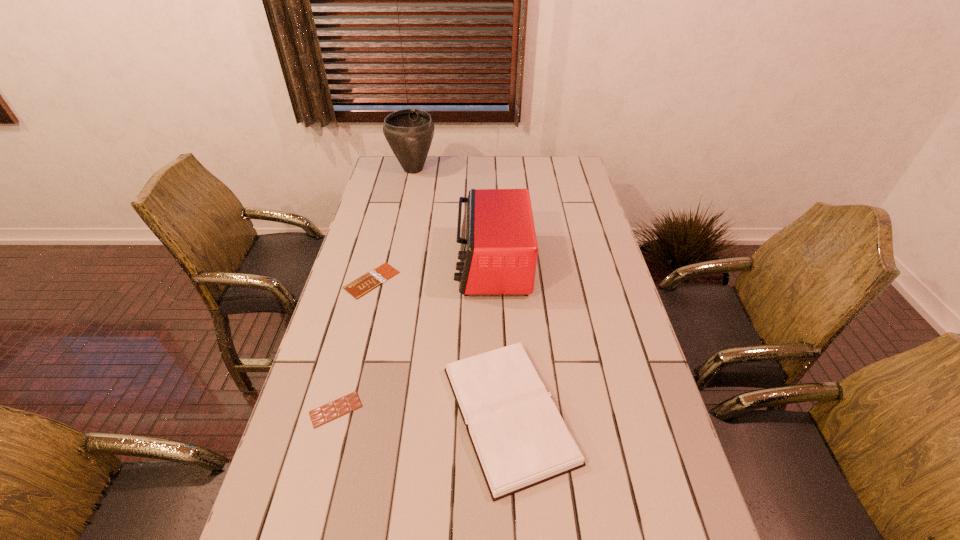
Locate an element on the screen. This screenshot has height=540, width=960. the farthest object is located at coordinates (409, 132).

This screenshot has height=540, width=960. Identify the location of urn. (409, 132).

Locate an element on the screen. This screenshot has height=540, width=960. the fourth shortest object is located at coordinates (498, 252).

Identify the location of the third tallest object. The width and height of the screenshot is (960, 540). 520,440.

You are a GUI agent. You are given a task and a screenshot of the screen. Output one action in this format:
    pyautogui.click(x=<x>, y=<y>)
    Task: Click on the fourth tallest object
    
    Given the screenshot: What is the action you would take?
    pyautogui.click(x=348, y=403)

Find the location of a particular element. This screenshot has height=540, width=960. the taller chocolate bar is located at coordinates (348, 403).

You are a GUI agent. You are given a task and a screenshot of the screen. Output one action in this format:
    pyautogui.click(x=<x>, y=<y>)
    Task: Click on the shorter chocolate bar
    
    Given the screenshot: What is the action you would take?
    pyautogui.click(x=374, y=278)

Where is `the farther chocolate bar`? This screenshot has width=960, height=540. the farther chocolate bar is located at coordinates (374, 278).

Where is `vacant position located 0.370m on the right of the farthest object`? vacant position located 0.370m on the right of the farthest object is located at coordinates (520, 169).

The image size is (960, 540). Find the location of `free space located on the front-facing side of the second tallest object`. free space located on the front-facing side of the second tallest object is located at coordinates (435, 265).